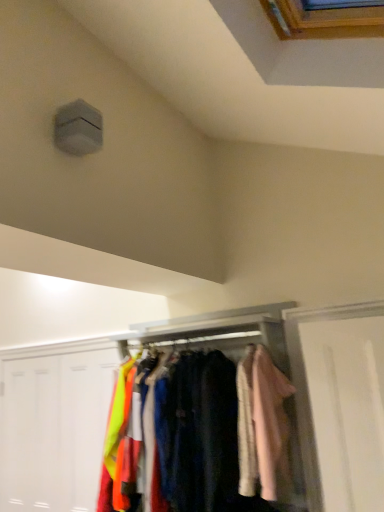
Question: Is light pink fabric coat at right further to camera compared to neon yellow fabric at lower left, marked as the second door in a left-to-right arrangement?

Choices:
 (A) yes
 (B) no

Answer: (B)

Question: Does light pink fabric coat at right have a greater width compared to neon yellow fabric at lower left, marked as the second door in a left-to-right arrangement?

Choices:
 (A) no
 (B) yes

Answer: (B)

Question: Does light pink fabric coat at right have a lesser width compared to neon yellow fabric at lower left, placed as the first door when sorted from right to left?

Choices:
 (A) yes
 (B) no

Answer: (B)

Question: Is light pink fabric coat at right to the left of neon yellow fabric at lower left, marked as the second door in a left-to-right arrangement, from the viewer's perspective?

Choices:
 (A) yes
 (B) no

Answer: (B)

Question: From a real-world perspective, is light pink fabric coat at right below neon yellow fabric at lower left, marked as the second door in a left-to-right arrangement?

Choices:
 (A) no
 (B) yes

Answer: (A)

Question: From a real-world perspective, is velvet fabric shirts at center positioned above or below white matte door at lower left, which is the second door in right-to-left order?

Choices:
 (A) above
 (B) below

Answer: (B)

Question: Is point (150, 448) positioned closer to the camera than point (44, 486)?

Choices:
 (A) farther
 (B) closer

Answer: (B)

Question: From the image's perspective, relative to white matte door at lower left, which is the second door in right-to-left order, is velvet fabric shirts at center above or below?

Choices:
 (A) above
 (B) below

Answer: (A)

Question: Is velvet fabric shirts at center to the left or to the right of white matte door at lower left, which is the second door in right-to-left order, in the image?

Choices:
 (A) right
 (B) left

Answer: (A)

Question: In terms of width, does light pink fabric coat at right look wider or thinner when compared to neon yellow fabric at lower left, placed as the first door when sorted from right to left?

Choices:
 (A) thin
 (B) wide

Answer: (B)

Question: Considering their positions, is light pink fabric coat at right located in front of or behind neon yellow fabric at lower left, placed as the first door when sorted from right to left?

Choices:
 (A) front
 (B) behind

Answer: (A)

Question: Looking at the image, does light pink fabric coat at right seem bigger or smaller compared to neon yellow fabric at lower left, marked as the second door in a left-to-right arrangement?

Choices:
 (A) small
 (B) big

Answer: (B)

Question: From a real-world perspective, is light pink fabric coat at right above or below neon yellow fabric at lower left, marked as the second door in a left-to-right arrangement?

Choices:
 (A) above
 (B) below

Answer: (A)

Question: Considering the positions of velvet fabric shirts at center and neon yellow fabric at lower left, placed as the first door when sorted from right to left, in the image, is velvet fabric shirts at center bigger or smaller than neon yellow fabric at lower left, placed as the first door when sorted from right to left,?

Choices:
 (A) big
 (B) small

Answer: (A)

Question: Is velvet fabric shirts at center in front of or behind neon yellow fabric at lower left, marked as the second door in a left-to-right arrangement, in the image?

Choices:
 (A) behind
 (B) front

Answer: (B)